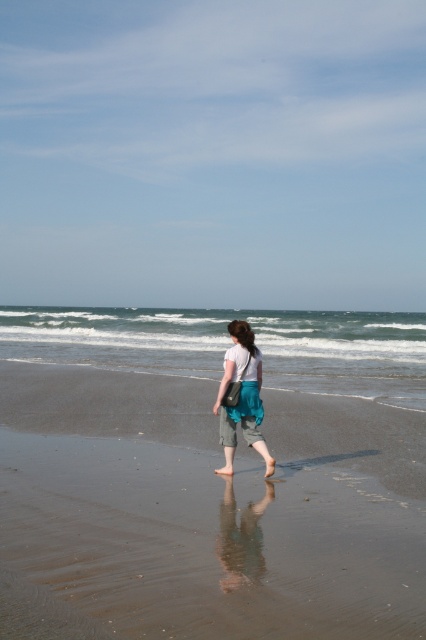
Question: Which point is closer to the camera?

Choices:
 (A) (206, 604)
 (B) (386, 396)

Answer: (A)

Question: Is brown sand at lower center smaller than greenish-blue water at center?

Choices:
 (A) no
 (B) yes

Answer: (B)

Question: Which is farther from the brown sand at lower center?

Choices:
 (A) greenish-blue water at center
 (B) teal fabric skirt at center

Answer: (A)

Question: Can you confirm if brown sand at lower center is positioned to the left of greenish-blue water at center?

Choices:
 (A) no
 (B) yes

Answer: (B)

Question: Is greenish-blue water at center above teal fabric skirt at center?

Choices:
 (A) yes
 (B) no

Answer: (A)

Question: Which object appears farthest from the camera in this image?

Choices:
 (A) greenish-blue water at center
 (B) teal fabric skirt at center
 (C) brown sand at lower center

Answer: (A)